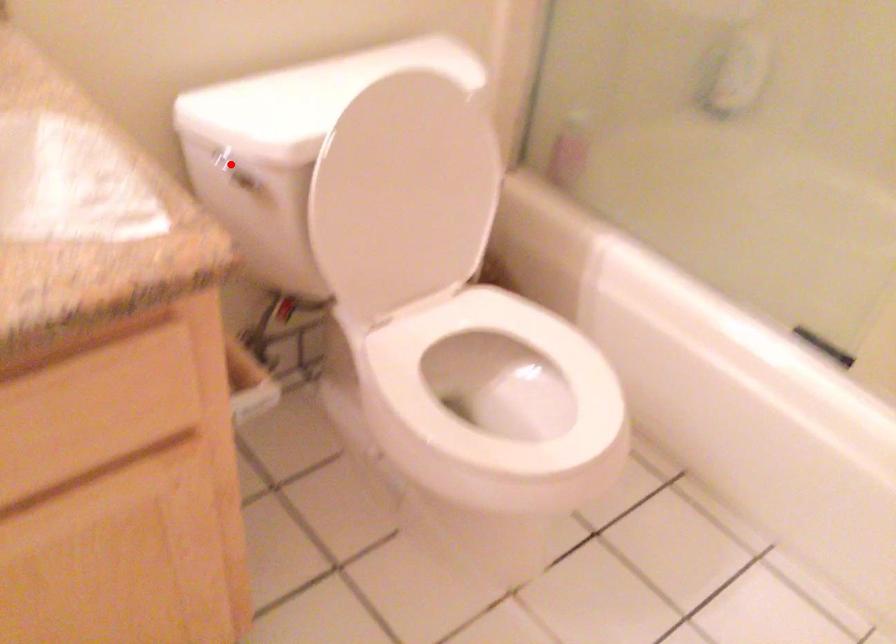
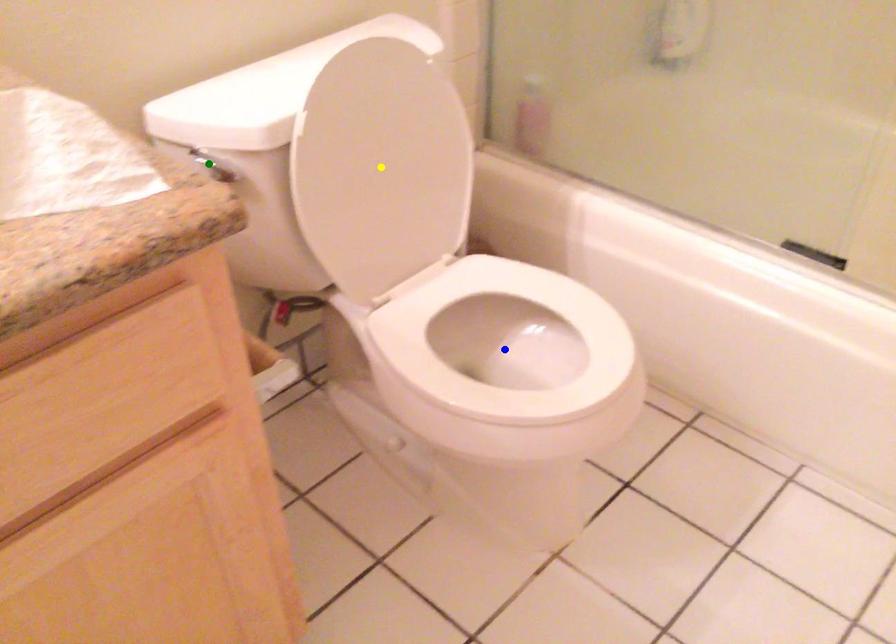
Question: I am providing you with two images of the same scene from different viewpoints. A red point is marked on the first image. You are given multiple points on the second image. Which mark in image 2 goes with the point in image 1?

Choices:
 (A) yellow point
 (B) blue point
 (C) green point

Answer: (C)